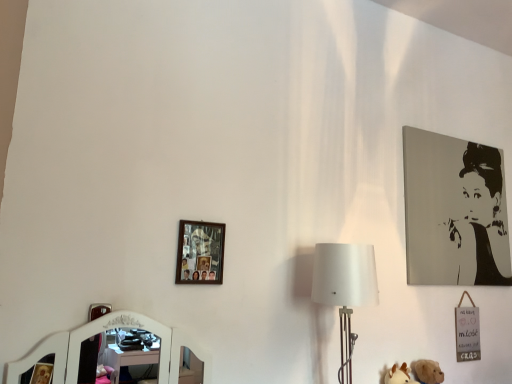
Question: Does white fabric lampshade at center-right lie in front of black and white portrait at upper right, the 1th picture frame from the right?

Choices:
 (A) yes
 (B) no

Answer: (A)

Question: Is white fabric lampshade at center-right aimed at black and white portrait at upper right, positioned as the 1th picture frame in back-to-front order?

Choices:
 (A) yes
 (B) no

Answer: (B)

Question: From a real-world perspective, is white fabric lampshade at center-right below black and white portrait at upper right, the second picture frame in the left-to-right sequence?

Choices:
 (A) no
 (B) yes

Answer: (B)

Question: Would you say black and white portrait at upper right, the second picture frame in the left-to-right sequence, is part of white fabric lampshade at center-right's contents?

Choices:
 (A) yes
 (B) no

Answer: (B)

Question: From the image's perspective, is white fabric lampshade at center-right located beneath black and white portrait at upper right, the second picture frame in the left-to-right sequence?

Choices:
 (A) yes
 (B) no

Answer: (A)

Question: Would you say white fabric lampshade at center-right is inside or outside black and white portrait at upper right, positioned as the 1th picture frame in back-to-front order?

Choices:
 (A) inside
 (B) outside

Answer: (B)

Question: Is white fabric lampshade at center-right wider or thinner than black and white portrait at upper right, the 1th picture frame from the right?

Choices:
 (A) thin
 (B) wide

Answer: (B)

Question: From the image's perspective, is white fabric lampshade at center-right positioned above or below black and white portrait at upper right, which is the 2th picture frame in front-to-back order?

Choices:
 (A) below
 (B) above

Answer: (A)

Question: From a real-world perspective, relative to black and white portrait at upper right, positioned as the 1th picture frame in back-to-front order, is white fabric lampshade at center-right vertically above or below?

Choices:
 (A) below
 (B) above

Answer: (A)

Question: From a real-world perspective, relative to wooden photo frame at upper left, which is the second picture frame in back-to-front order, is white fabric lampshade at center-right vertically above or below?

Choices:
 (A) below
 (B) above

Answer: (A)

Question: Visually, is white fabric lampshade at center-right positioned to the left or to the right of wooden photo frame at upper left, which is the second picture frame in back-to-front order?

Choices:
 (A) right
 (B) left

Answer: (A)

Question: Is white fabric lampshade at center-right wider or thinner than wooden photo frame at upper left, the 1th picture frame in the front-to-back sequence?

Choices:
 (A) thin
 (B) wide

Answer: (B)

Question: Is white fabric lampshade at center-right inside the boundaries of wooden photo frame at upper left, the 1th picture frame in the front-to-back sequence, or outside?

Choices:
 (A) inside
 (B) outside

Answer: (B)

Question: From a real-world perspective, relative to wooden photo frame at upper left, which is the second picture frame in back-to-front order, is black and white portrait at upper right, positioned as the 1th picture frame in back-to-front order, vertically above or below?

Choices:
 (A) above
 (B) below

Answer: (A)

Question: In the image, is black and white portrait at upper right, the 1th picture frame from the right, positioned in front of or behind wooden photo frame at upper left, arranged as the first picture frame when viewed from the left?

Choices:
 (A) behind
 (B) front

Answer: (A)